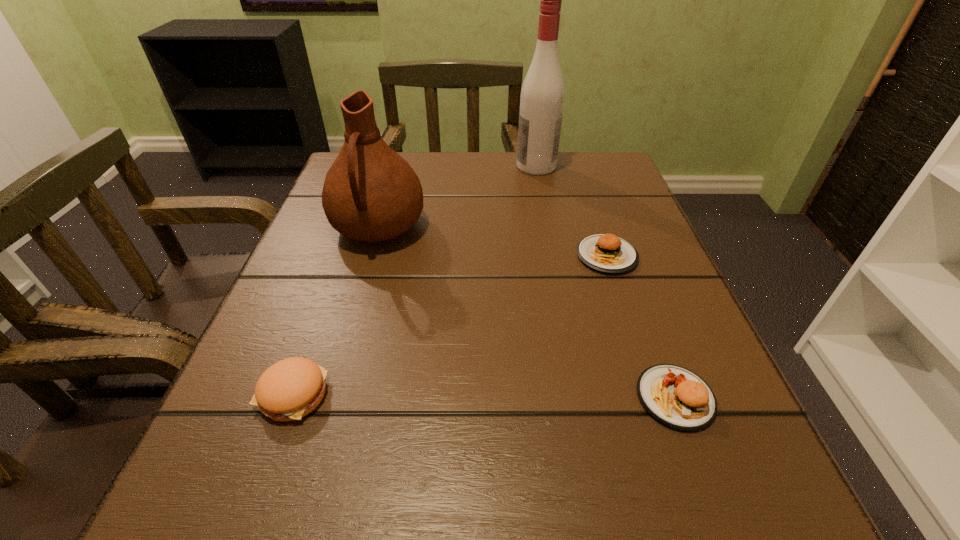
Find the location of a particular element. The width and height of the screenshot is (960, 540). free space between the farthest food and the tallest object is located at coordinates (571, 211).

Find the location of a particular element. This screenshot has width=960, height=540. blank region between the farthest object and the fourth shortest object is located at coordinates (457, 197).

Locate an element on the screen. Image resolution: width=960 pixels, height=540 pixels. vacant point located between the second tallest object and the leftmost food is located at coordinates (336, 311).

This screenshot has height=540, width=960. I want to click on vacant point located between the leftmost food and the pitcher, so click(x=336, y=311).

Identify the location of blank region between the alcohol and the farthest food. This screenshot has height=540, width=960. (571, 211).

Locate which object is the fourth closest to the tallest object. Please provide its 2D coordinates. Your answer should be formatted as a tuple, i.e. [(x, y)], where the tuple contains the x and y coordinates of a point satisfying the conditions above.

[(290, 389)]

Identify which object is located as the third nearest to the second tallest object. Please provide its 2D coordinates. Your answer should be formatted as a tuple, i.e. [(x, y)], where the tuple contains the x and y coordinates of a point satisfying the conditions above.

[(607, 253)]

Find the location of a particular element. Image resolution: width=960 pixels, height=540 pixels. the second closest food to the alcohol is located at coordinates (677, 397).

Identify which food is the second nearest to the pitcher. Please provide its 2D coordinates. Your answer should be formatted as a tuple, i.e. [(x, y)], where the tuple contains the x and y coordinates of a point satisfying the conditions above.

[(607, 253)]

You are a GUI agent. You are given a task and a screenshot of the screen. Output one action in this format:
    pyautogui.click(x=<x>, y=<y>)
    Task: Click on the free space that satisfies the following two spatial constraints: 1. on the front side of the tallest food; 2. on the left side of the farthest food
    Image resolution: width=960 pixels, height=540 pixels.
    Given the screenshot: What is the action you would take?
    pyautogui.click(x=655, y=397)